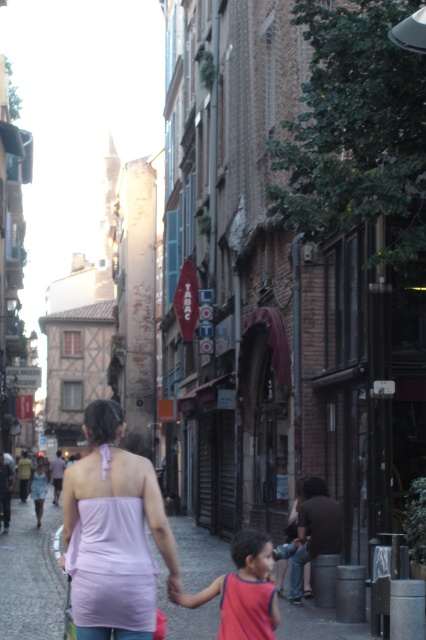
Does point (160, 492) come in front of point (224, 632)?

That is True.

Is lavender satin halter top at center shorter than red sleeveless shirt at lower center?

No.

Which is in front, point (92, 490) or point (226, 618)?

Positioned in front is point (92, 490).

The height and width of the screenshot is (640, 426). In order to click on lavender satin halter top at center in this screenshot , I will do `click(114, 532)`.